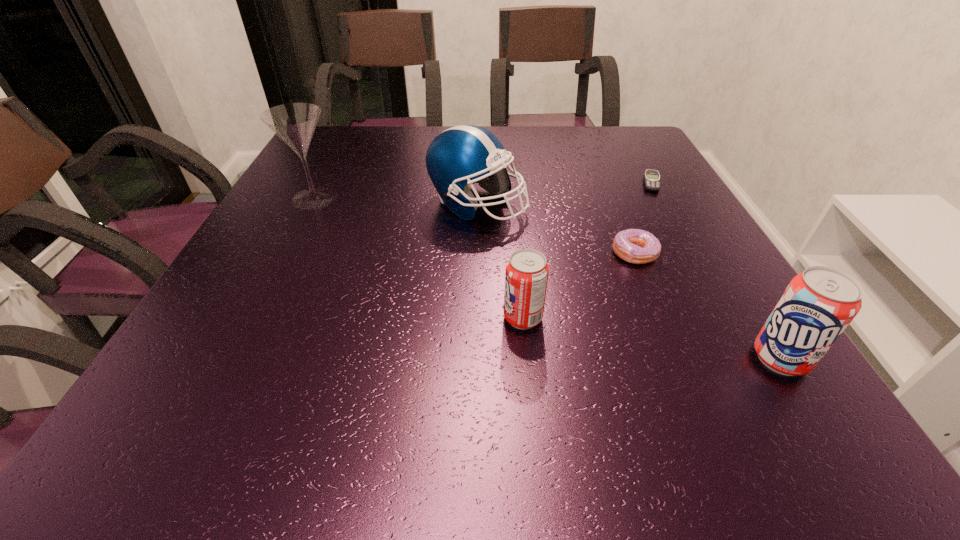
At what (x,y) coordinates should I click in order to perform the action: click on the fourth tallest object. Please return your answer as a coordinate pair (x, y). This screenshot has height=540, width=960. Looking at the image, I should click on (x=526, y=276).

Locate an element on the screen. Image resolution: width=960 pixels, height=540 pixels. the farther soda can is located at coordinates (526, 276).

Where is `the right soda can`? The image size is (960, 540). the right soda can is located at coordinates (817, 306).

This screenshot has width=960, height=540. Identify the location of the taller soda can. (817, 306).

Find the location of a particular element. The height and width of the screenshot is (540, 960). beeper is located at coordinates (652, 180).

Where is `football helmet`? The image size is (960, 540). football helmet is located at coordinates (466, 154).

Image resolution: width=960 pixels, height=540 pixels. I want to click on flute glass, so click(x=294, y=123).

This screenshot has width=960, height=540. Find the location of `the fifth tallest object`. the fifth tallest object is located at coordinates [x=636, y=246].

I want to click on the fourth farthest object, so click(636, 246).

Where is `vacant space located 0.260m on the back of the second nearest object`? This screenshot has height=540, width=960. vacant space located 0.260m on the back of the second nearest object is located at coordinates (514, 220).